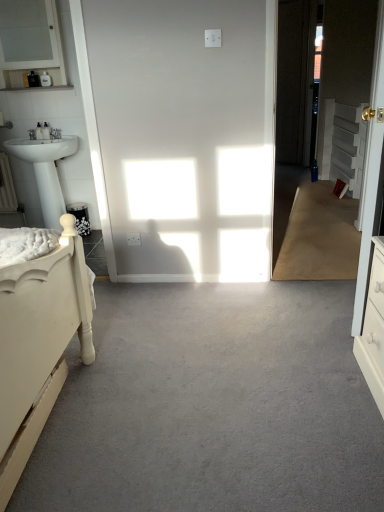
The image size is (384, 512). I want to click on free location above gray carpet at center (from a real-world perspective), so click(161, 371).